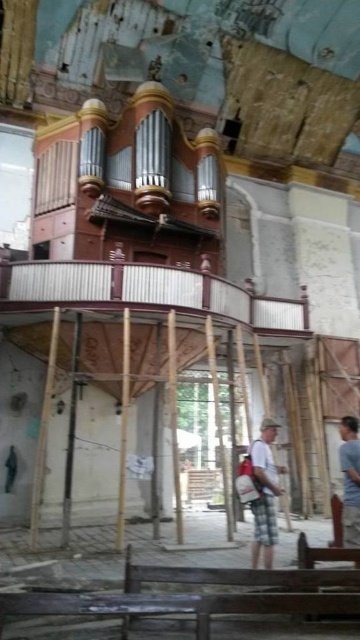
You are standing in the old church and want to place a small statue on the floor. You have two options for placement based on coordinates given in the image description. The first option is at point (275,577), and the second is at point (258,547). Which point is closer to you where you can place the statue?

Point (275,577) is closer to the viewer than point (258,547), so you should place the statue there.

You are a visitor to the church and want to sit down. You see a wooden bench at lower center and light brown plaid shorts at center. Which one can you sit on?

The wooden bench at lower center is larger in size than light brown plaid shorts at center, so you can sit on the wooden bench at lower center.

Based on the photo, you are standing in the old church and see the point at coordinates [264,493]. According to the image, what object is this point located on?

The point at coordinates [264,493] is located on the light brown plaid shorts at center.